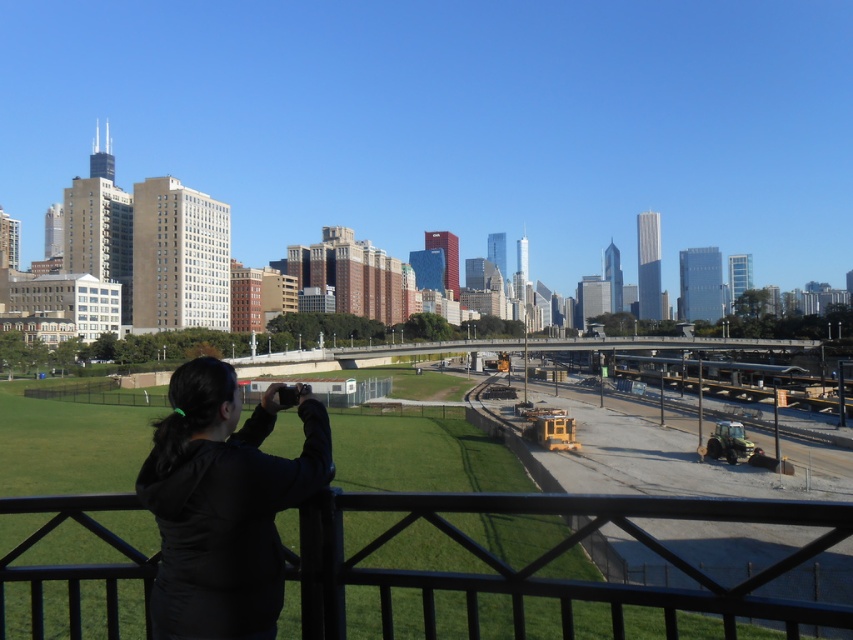
Question: Does black metal/rail at lower center appear on the right side of black fabric at left?

Choices:
 (A) no
 (B) yes

Answer: (A)

Question: Which point is farther to the camera?

Choices:
 (A) (303, 545)
 (B) (239, 529)

Answer: (A)

Question: Can you confirm if black metal/rail at lower center is wider than black fabric at left?

Choices:
 (A) yes
 (B) no

Answer: (A)

Question: Is black metal/rail at lower center positioned before black fabric at left?

Choices:
 (A) yes
 (B) no

Answer: (A)

Question: Which object appears closest to the camera in this image?

Choices:
 (A) black fabric at left
 (B) black metal/rail at lower center

Answer: (B)

Question: Which point is farther from the camera taking this photo?

Choices:
 (A) (166, 468)
 (B) (53, 520)

Answer: (B)